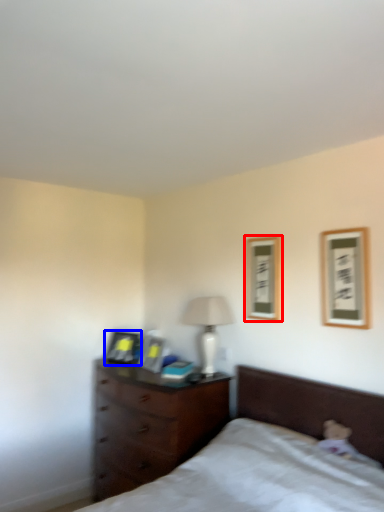
Question: Among these objects, which one is farthest to the camera, picture frame (highlighted by a red box) or picture frame (highlighted by a blue box)?

Choices:
 (A) picture frame
 (B) picture frame

Answer: (B)